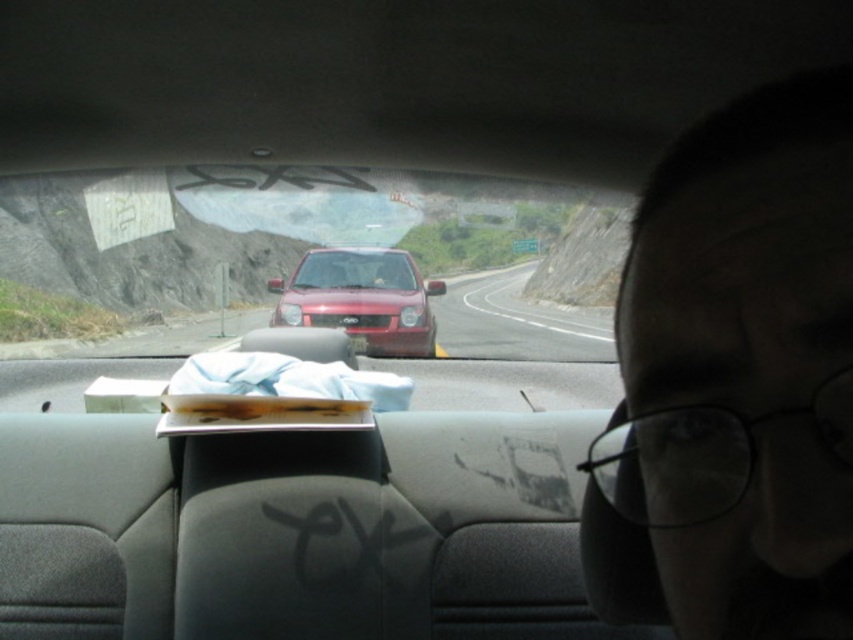
Question: Among these objects, which one is nearest to the camera?

Choices:
 (A) brown leather wallet at center
 (B) smooth asphalt road at center

Answer: (A)

Question: Is clear plastic glasses at right in front of brown leather wallet at center?

Choices:
 (A) no
 (B) yes

Answer: (B)

Question: Which of these objects is positioned closest to the glossy red suv at center?

Choices:
 (A) smooth asphalt road at center
 (B) brown leather wallet at center

Answer: (A)

Question: Is clear plastic glasses at right behind smooth asphalt road at center?

Choices:
 (A) yes
 (B) no

Answer: (B)

Question: Based on their relative distances, which object is farther from the smooth asphalt road at center?

Choices:
 (A) brown leather wallet at center
 (B) clear plastic glasses at right

Answer: (B)

Question: Observing the image, what is the correct spatial positioning of smooth asphalt road at center in reference to brown leather wallet at center?

Choices:
 (A) above
 (B) below

Answer: (A)